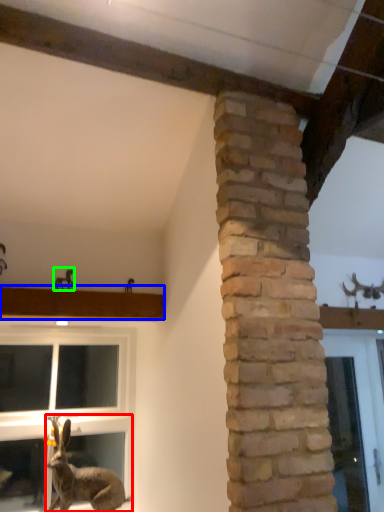
Question: Which object is positioned farthest from rabbit (highlighted by a red box)? Select from window sill (highlighted by a blue box) and animal (highlighted by a green box).

Choices:
 (A) window sill
 (B) animal

Answer: (B)